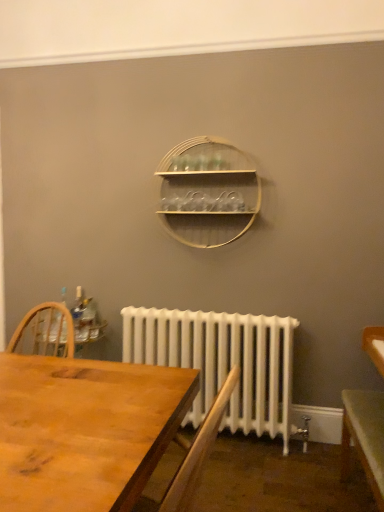
What is the approximate height of white painted radiator at lower center?

The height of white painted radiator at lower center is 31.79 inches.

Where is `clear plastic bottle at left`? The height and width of the screenshot is (512, 384). clear plastic bottle at left is located at coordinates (78, 312).

Measure the distance between point [75,306] and camera.

They are 2.83 meters apart.

You are a GUI agent. You are given a task and a screenshot of the screen. Output one action in this format:
    pyautogui.click(x=<x>, y=<y>)
    Task: Click on the wooden at center
    Image resolution: width=384 pixels, height=512 pixels.
    Given the screenshot: What is the action you would take?
    pyautogui.click(x=207, y=192)

Identify the location of green matte table at lower right. (365, 437).

Describe the element at coordinates (365, 437) in the screenshot. I see `green matte table at lower right` at that location.

What are the coordinates of `white painted radiator at lower center` in the screenshot? It's located at (221, 362).

Looking at this image, considering the relative sizes of wooden at center and clear plastic bottle at left in the image provided, is wooden at center bigger than clear plastic bottle at left?

Yes, wooden at center is bigger than clear plastic bottle at left.

In the scene shown: Based on their positions, is wooden at center located to the left or right of clear plastic bottle at left?

From the image, it's evident that wooden at center is to the right of clear plastic bottle at left.

Would you say clear plastic bottle at left is part of wooden at center's contents?

No, clear plastic bottle at left is not inside wooden at center.

From the image's perspective, which is below, wooden at center or clear plastic bottle at left?

From the image's view, clear plastic bottle at left is below.

Is point (230, 188) closer or farther from the camera than point (342, 465)?

Point (230, 188) is positioned farther from the camera compared to point (342, 465).

From a real-world perspective, is wooden at center physically above green matte table at lower right?

Yes.

Which object is wider, wooden at center or green matte table at lower right?

With larger width is green matte table at lower right.

Considering the relative sizes of clear plastic bottle at left and green matte table at lower right in the image provided, is clear plastic bottle at left thinner than green matte table at lower right?

Yes, clear plastic bottle at left is thinner than green matte table at lower right.

Are clear plastic bottle at left and green matte table at lower right located far from each other?

Absolutely, clear plastic bottle at left is distant from green matte table at lower right.

Is clear plastic bottle at left in front of or behind green matte table at lower right in the image?

clear plastic bottle at left is behind green matte table at lower right.

Which is more to the left, clear plastic bottle at left or white painted radiator at lower center?

Positioned to the left is clear plastic bottle at left.

Can you confirm if clear plastic bottle at left is shorter than white painted radiator at lower center?

Correct, clear plastic bottle at left is not as tall as white painted radiator at lower center.

Between clear plastic bottle at left and white painted radiator at lower center, which one has smaller size?

clear plastic bottle at left is smaller.

Is clear plastic bottle at left looking in the opposite direction of white painted radiator at lower center?

No, clear plastic bottle at left's orientation is not away from white painted radiator at lower center.

Is wooden at center facing away from wooden desk at center?

wooden at center does not have its back to wooden desk at center.

How distant is wooden at center from wooden desk at center?

4.83 feet.

The width and height of the screenshot is (384, 512). Identify the location of desk that appears on the left of wooden at center. click(x=84, y=430).

Is green matte table at lower right not near wooden at center?

Yes.

Is green matte table at lower right spatially inside wooden at center, or outside of it?

green matte table at lower right is outside wooden at center.

How far apart are green matte table at lower right and wooden at center?

They are 1.39 meters apart.

Locate an element on the screen. The width and height of the screenshot is (384, 512). shelf on the left of the green matte table at lower right is located at coordinates (207, 192).

Find the location of a particular element. This screenshot has width=384, height=512. radiator below the wooden desk at center (from the image's perspective) is located at coordinates (221, 362).

Between white painted radiator at lower center and wooden desk at center, which one has less height?

With less height is wooden desk at center.

From a real-world perspective, who is located higher, white painted radiator at lower center or wooden desk at center?

From a 3D spatial view, wooden desk at center is above.

This screenshot has height=512, width=384. In order to click on shelf above the clear plastic bottle at left (from the image's perspective) in this screenshot , I will do `click(207, 192)`.

Image resolution: width=384 pixels, height=512 pixels. Identify the location of shelf behind the green matte table at lower right. (207, 192).

From the image, which object appears to be nearer to wooden desk at center, wooden at center or green matte table at lower right?

green matte table at lower right lies closer to wooden desk at center than the other object.

Which object lies further to the anchor point wooden at center, green matte table at lower right or clear plastic bottle at left?

Based on the image, green matte table at lower right appears to be further to wooden at center.

Based on their spatial positions, is green matte table at lower right or white painted radiator at lower center closer to wooden at center?

The object closer to wooden at center is white painted radiator at lower center.

Based on their spatial positions, is white painted radiator at lower center or wooden at center further from wooden desk at center?

Among the two, wooden at center is located further to wooden desk at center.

In the scene shown: Based on their spatial positions, is white painted radiator at lower center or wooden desk at center further from clear plastic bottle at left?

Based on the image, wooden desk at center appears to be further to clear plastic bottle at left.

Looking at the image, which one is located closer to wooden at center, white painted radiator at lower center or wooden desk at center?

white painted radiator at lower center lies closer to wooden at center than the other object.

Looking at the image, which one is located closer to white painted radiator at lower center, green matte table at lower right or wooden at center?

Based on the image, wooden at center appears to be nearer to white painted radiator at lower center.

From the image, which object appears to be farther from wooden at center, wooden desk at center or clear plastic bottle at left?

wooden desk at center lies further to wooden at center than the other object.

This screenshot has width=384, height=512. I want to click on shelf between wooden desk at center and clear plastic bottle at left from front to back, so click(x=207, y=192).

This screenshot has height=512, width=384. In order to click on radiator located between wooden desk at center and clear plastic bottle at left in the depth direction in this screenshot , I will do `click(221, 362)`.

At what (x,y) coordinates should I click in order to perform the action: click on table between wooden desk at center and white painted radiator at lower center along the z-axis. Please return your answer as a coordinate pair (x, y). Image resolution: width=384 pixels, height=512 pixels. Looking at the image, I should click on (365, 437).

Where is `bottle between wooden at center and white painted radiator at lower center from top to bottom`? The image size is (384, 512). bottle between wooden at center and white painted radiator at lower center from top to bottom is located at coordinates (78, 312).